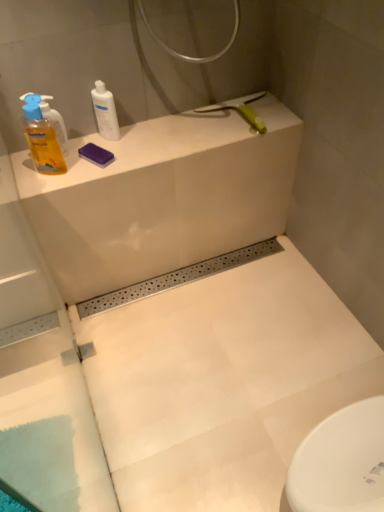
The image size is (384, 512). I want to click on free space that is in between yellow translucent liquid at left, the 2th cleaning product from the right, and white glossy bottle at upper left, arranged as the 2th cleaning product when viewed from the left, so click(86, 153).